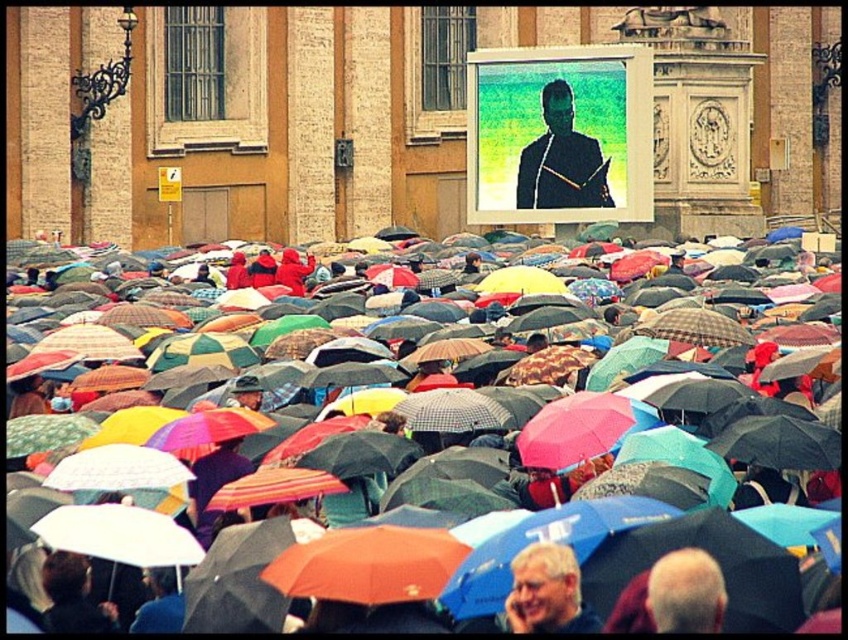
Question: Is matte black umbrella at center below matte gray hair at lower center?

Choices:
 (A) no
 (B) yes

Answer: (A)

Question: Among these points, which one is nearest to the camera?

Choices:
 (A) coord(565,609)
 (B) coord(555,348)

Answer: (A)

Question: Which of the following is the farthest from the observer?

Choices:
 (A) (512, 563)
 (B) (343, 352)

Answer: (B)

Question: Which point is closer to the camera?

Choices:
 (A) matte gray hair at lower center
 (B) matte black umbrella at center

Answer: (B)

Question: Is matte black umbrella at center to the right of matte gray hair at lower center from the viewer's perspective?

Choices:
 (A) yes
 (B) no

Answer: (A)

Question: Considering the relative positions of matte black umbrella at center and matte gray hair at lower center in the image provided, where is matte black umbrella at center located with respect to matte gray hair at lower center?

Choices:
 (A) below
 (B) above

Answer: (B)